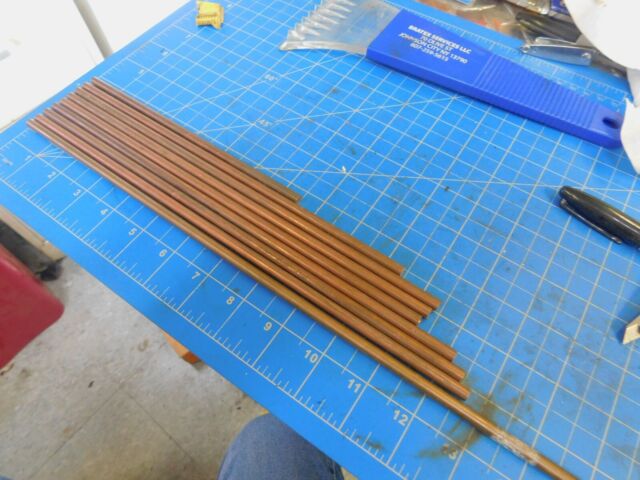
The image size is (640, 480). What are the coordinates of `floor` in the screenshot? It's located at (97, 411).